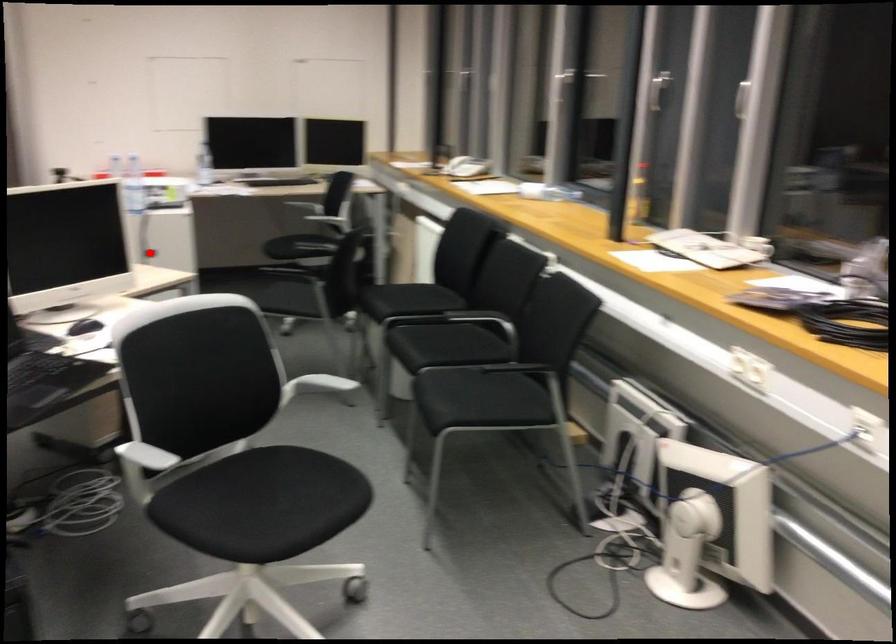
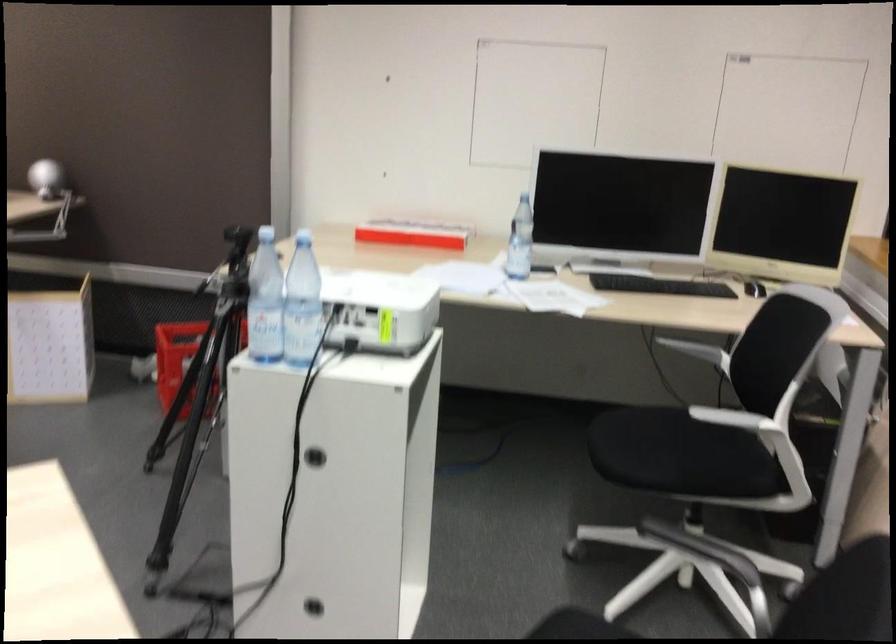
Question: I am providing you with two images of the same scene from different viewpoints. A red point is shown in image1. For the corresponding object point in image2, is it positioned nearer or farther from the camera?

Choices:
 (A) Nearer
 (B) Farther

Answer: (A)